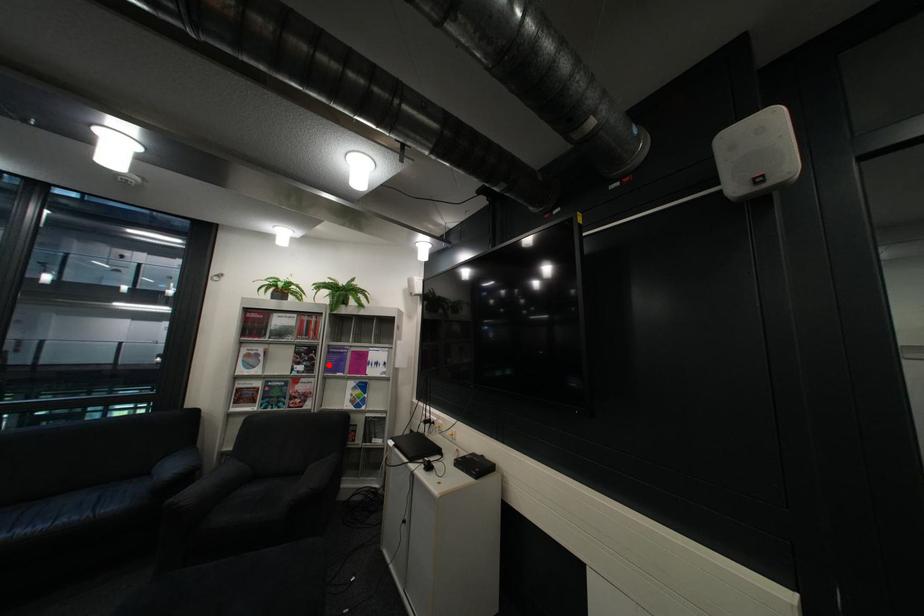
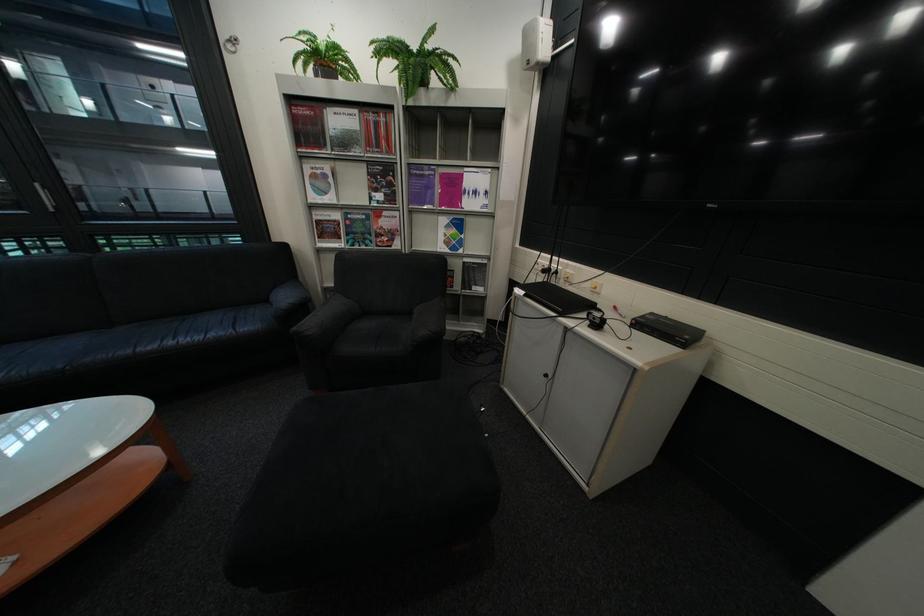
In the second image, find the point that corresponds to the highlighted location in the first image.

(409, 192)